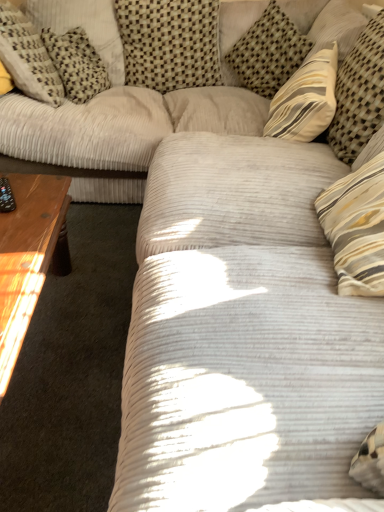
The image size is (384, 512). In order to click on checkered fabric pillow at upper left, which ranks as the fourth pillow in right-to-left order in this screenshot , I will do `click(84, 27)`.

Describe the element at coordinates (28, 57) in the screenshot. I see `white corduroy pillow at upper left, marked as the first pillow in a left-to-right arrangement` at that location.

In order to face striped fabric pillow at upper right, the 1th pillow when ordered from right to left, should I rotate leftwards or rightwards?

You should look right and rotate roughly 25.736 degrees.

Find the location of a particular element. The image size is (384, 512). striped fabric pillow at upper right, the 1th pillow when ordered from right to left is located at coordinates (359, 93).

Identify the location of checkered fabric pillow at upper left, which ranks as the fourth pillow in right-to-left order. (84, 27).

Can you confirm if striped fabric pillow at upper right, which is counted as the 2th pillow, starting from the right, is bigger than woven beige pillow at upper center, the third pillow from the left?

No, striped fabric pillow at upper right, which is counted as the 2th pillow, starting from the right, is not bigger than woven beige pillow at upper center, the third pillow from the left.

From the picture: Does striped fabric pillow at upper right, which is counted as the 2th pillow, starting from the right, turn towards woven beige pillow at upper center, the 3th pillow from the right?

No, striped fabric pillow at upper right, which is counted as the 2th pillow, starting from the right, is not oriented towards woven beige pillow at upper center, the 3th pillow from the right.

Which is more to the right, striped fabric pillow at upper right, which is the 4th pillow in left-to-right order, or woven beige pillow at upper center, the third pillow from the left?

From the viewer's perspective, striped fabric pillow at upper right, which is the 4th pillow in left-to-right order, appears more on the right side.

From a real-world perspective, is striped fabric pillow at upper right, which is counted as the 2th pillow, starting from the right, below woven beige pillow at upper center, the 3th pillow from the right?

No, from a real-world perspective, striped fabric pillow at upper right, which is counted as the 2th pillow, starting from the right, is not beneath woven beige pillow at upper center, the 3th pillow from the right.

From a real-world perspective, is striped fabric pillow at upper right, the 5th pillow in the left-to-right sequence, below striped fabric pillow at upper right, which is the 4th pillow in left-to-right order?

No, from a real-world perspective, striped fabric pillow at upper right, the 5th pillow in the left-to-right sequence, is not below striped fabric pillow at upper right, which is the 4th pillow in left-to-right order.

From the picture: Can you tell me how much striped fabric pillow at upper right, the 5th pillow in the left-to-right sequence, and striped fabric pillow at upper right, which is the 4th pillow in left-to-right order, differ in facing direction?

42.6 degrees separate the facing orientations of striped fabric pillow at upper right, the 5th pillow in the left-to-right sequence, and striped fabric pillow at upper right, which is the 4th pillow in left-to-right order.

Is striped fabric pillow at upper right, the 5th pillow in the left-to-right sequence, to the right of striped fabric pillow at upper right, which is the 4th pillow in left-to-right order, from the viewer's perspective?

Yes, striped fabric pillow at upper right, the 5th pillow in the left-to-right sequence, is to the right of striped fabric pillow at upper right, which is the 4th pillow in left-to-right order.

Does point (349, 129) come in front of point (233, 66)?

That is True.

Measure the distance from checkered fabric pillow at upper left, which is the 2th pillow in left-to-right order, to striped fabric pillow at upper right, the 5th pillow in the left-to-right sequence.

checkered fabric pillow at upper left, which is the 2th pillow in left-to-right order, and striped fabric pillow at upper right, the 5th pillow in the left-to-right sequence, are 4.31 feet apart from each other.

Between point (45, 16) and point (372, 84), which one is positioned behind?

Positioned behind is point (45, 16).

From the image's perspective, between checkered fabric pillow at upper left, which is the 2th pillow in left-to-right order, and striped fabric pillow at upper right, the 5th pillow in the left-to-right sequence, who is located below?

striped fabric pillow at upper right, the 5th pillow in the left-to-right sequence, appears lower in the image.

Does checkered fabric pillow at upper left, which is the 2th pillow in left-to-right order, turn towards striped fabric pillow at upper right, the 1th pillow when ordered from right to left?

No.

Considering the positions of objects light brown wooden coffee table at left and white corduroy pillow at upper left, which is counted as the 5th pillow, starting from the right, in the image provided, who is more to the right, light brown wooden coffee table at left or white corduroy pillow at upper left, which is counted as the 5th pillow, starting from the right,?

Positioned to the right is light brown wooden coffee table at left.

Is light brown wooden coffee table at left looking in the opposite direction of white corduroy pillow at upper left, which is counted as the 5th pillow, starting from the right?

No.

Is light brown wooden coffee table at left wider or thinner than white corduroy pillow at upper left, marked as the first pillow in a left-to-right arrangement?

In the image, light brown wooden coffee table at left appears to be more narrow than white corduroy pillow at upper left, marked as the first pillow in a left-to-right arrangement.

Is light brown wooden coffee table at left behind white corduroy pillow at upper left, marked as the first pillow in a left-to-right arrangement?

No, the depth of light brown wooden coffee table at left is less than that of white corduroy pillow at upper left, marked as the first pillow in a left-to-right arrangement.

Can you confirm if light brown wooden coffee table at left is wider than woven beige pillow at upper center, the third pillow from the left?

Yes, light brown wooden coffee table at left is wider than woven beige pillow at upper center, the third pillow from the left.

Considering the relative positions of light brown wooden coffee table at left and woven beige pillow at upper center, the 3th pillow from the right, in the image provided, is light brown wooden coffee table at left to the left of woven beige pillow at upper center, the 3th pillow from the right, from the viewer's perspective?

Yes.

Considering the relative sizes of light brown wooden coffee table at left and woven beige pillow at upper center, the third pillow from the left, in the image provided, is light brown wooden coffee table at left shorter than woven beige pillow at upper center, the third pillow from the left,?

Indeed, light brown wooden coffee table at left has a lesser height compared to woven beige pillow at upper center, the third pillow from the left.

Which is more to the left, white corduroy pillow at upper left, which is counted as the 5th pillow, starting from the right, or light brown wooden coffee table at left?

Positioned to the left is white corduroy pillow at upper left, which is counted as the 5th pillow, starting from the right.

Is white corduroy pillow at upper left, which is counted as the 5th pillow, starting from the right, bigger than light brown wooden coffee table at left?

No.

The width and height of the screenshot is (384, 512). In order to click on the 2nd pillow to the left of the light brown wooden coffee table at left, starting your count from the anchor in this screenshot , I will do `click(28, 57)`.

How different are the orientations of white corduroy pillow at upper left, which is counted as the 5th pillow, starting from the right, and light brown wooden coffee table at left in degrees?

90.9 degrees.

Which is further, (x=349, y=69) or (x=111, y=39)?

The point (x=111, y=39) is farther.

From the image's perspective, which is below, striped fabric pillow at upper right, the 1th pillow when ordered from right to left, or checkered fabric pillow at upper left, which ranks as the fourth pillow in right-to-left order?

From the image's view, striped fabric pillow at upper right, the 1th pillow when ordered from right to left, is below.

Does striped fabric pillow at upper right, the 1th pillow when ordered from right to left, have a greater width compared to checkered fabric pillow at upper left, which is the 2th pillow in left-to-right order?

Yes, striped fabric pillow at upper right, the 1th pillow when ordered from right to left, is wider than checkered fabric pillow at upper left, which is the 2th pillow in left-to-right order.

Who is smaller, striped fabric pillow at upper right, the 5th pillow in the left-to-right sequence, or checkered fabric pillow at upper left, which ranks as the fourth pillow in right-to-left order?

With smaller size is striped fabric pillow at upper right, the 5th pillow in the left-to-right sequence.

You are a GUI agent. You are given a task and a screenshot of the screen. Output one action in this format:
    pyautogui.click(x=<x>, y=<y>)
    Task: Click on the pillow that is the 1st object directly below the striped fabric pillow at upper right, which is the 4th pillow in left-to-right order (from a real-world perspective)
    Image resolution: width=384 pixels, height=512 pixels.
    Given the screenshot: What is the action you would take?
    pyautogui.click(x=170, y=42)

From the striped fabric pillow at upper right, which is the 4th pillow in left-to-right order, count 2nd pillows forward and point to it. Please provide its 2D coordinates.

[(359, 93)]

Considering their positions, is light brown wooden coffee table at left positioned further to striped fabric pillow at upper right, the 5th pillow in the left-to-right sequence, than checkered fabric pillow at upper left, which ranks as the fourth pillow in right-to-left order?

checkered fabric pillow at upper left, which ranks as the fourth pillow in right-to-left order.

Which object lies nearer to the anchor point light brown wooden coffee table at left, white corduroy pillow at upper left, which is counted as the 5th pillow, starting from the right, or woven beige pillow at upper center, the third pillow from the left?

Based on the image, white corduroy pillow at upper left, which is counted as the 5th pillow, starting from the right, appears to be nearer to light brown wooden coffee table at left.

Considering their positions, is striped fabric pillow at upper right, the 1th pillow when ordered from right to left, positioned closer to light brown wooden coffee table at left than striped fabric pillow at upper right, which is counted as the 2th pillow, starting from the right?

striped fabric pillow at upper right, the 1th pillow when ordered from right to left, is closer to light brown wooden coffee table at left.

Based on their spatial positions, is woven beige pillow at upper center, the third pillow from the left, or white corduroy pillow at upper left, marked as the first pillow in a left-to-right arrangement, closer to striped fabric pillow at upper right, which is the 4th pillow in left-to-right order?

woven beige pillow at upper center, the third pillow from the left, is closer to striped fabric pillow at upper right, which is the 4th pillow in left-to-right order.

Consider the image. From the image, which object appears to be nearer to woven beige pillow at upper center, the third pillow from the left, striped fabric pillow at upper right, which is counted as the 2th pillow, starting from the right, or light brown wooden coffee table at left?

striped fabric pillow at upper right, which is counted as the 2th pillow, starting from the right, lies closer to woven beige pillow at upper center, the third pillow from the left, than the other object.

Which object lies nearer to the anchor point woven beige pillow at upper center, the third pillow from the left, light brown wooden coffee table at left or white corduroy pillow at upper left, which is counted as the 5th pillow, starting from the right?

white corduroy pillow at upper left, which is counted as the 5th pillow, starting from the right, lies closer to woven beige pillow at upper center, the third pillow from the left, than the other object.

Considering their positions, is striped fabric pillow at upper right, which is the 4th pillow in left-to-right order, positioned closer to light brown wooden coffee table at left than striped fabric pillow at upper right, the 5th pillow in the left-to-right sequence?

striped fabric pillow at upper right, the 5th pillow in the left-to-right sequence, is positioned closer to the anchor light brown wooden coffee table at left.

When comparing their distances from light brown wooden coffee table at left, does checkered fabric pillow at upper left, which ranks as the fourth pillow in right-to-left order, or woven beige pillow at upper center, the third pillow from the left, seem further?

woven beige pillow at upper center, the third pillow from the left, lies further to light brown wooden coffee table at left than the other object.

Locate an element on the screen. The image size is (384, 512). pillow situated between checkered fabric pillow at upper left, which ranks as the fourth pillow in right-to-left order, and striped fabric pillow at upper right, which is counted as the 2th pillow, starting from the right, from left to right is located at coordinates (170, 42).

The image size is (384, 512). What are the coordinates of `pillow between white corduroy pillow at upper left, marked as the first pillow in a left-to-right arrangement, and woven beige pillow at upper center, the third pillow from the left` in the screenshot? It's located at (84, 27).

What are the coordinates of `coffee table located between white corduroy pillow at upper left, which is counted as the 5th pillow, starting from the right, and striped fabric pillow at upper right, the 5th pillow in the left-to-right sequence, in the left-right direction` in the screenshot? It's located at (29, 257).